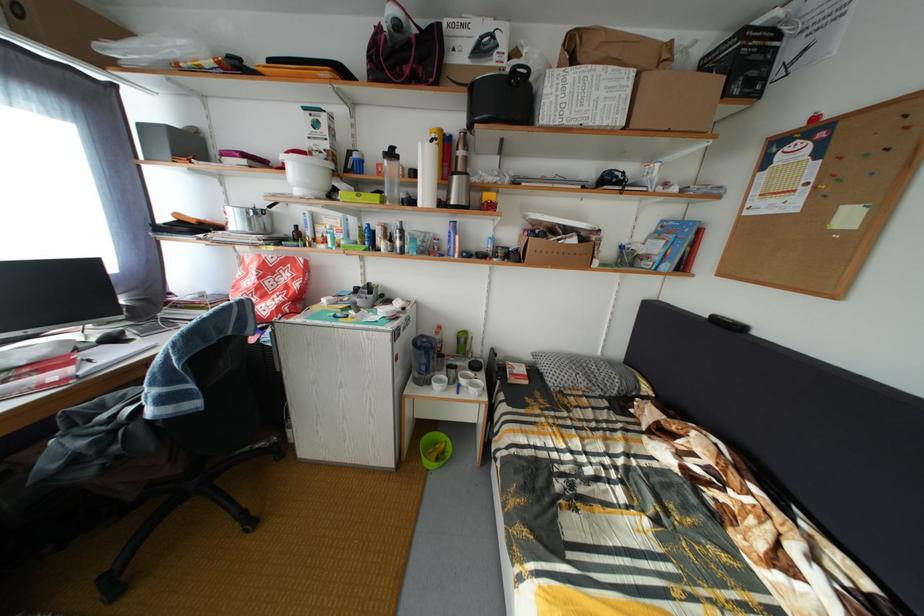
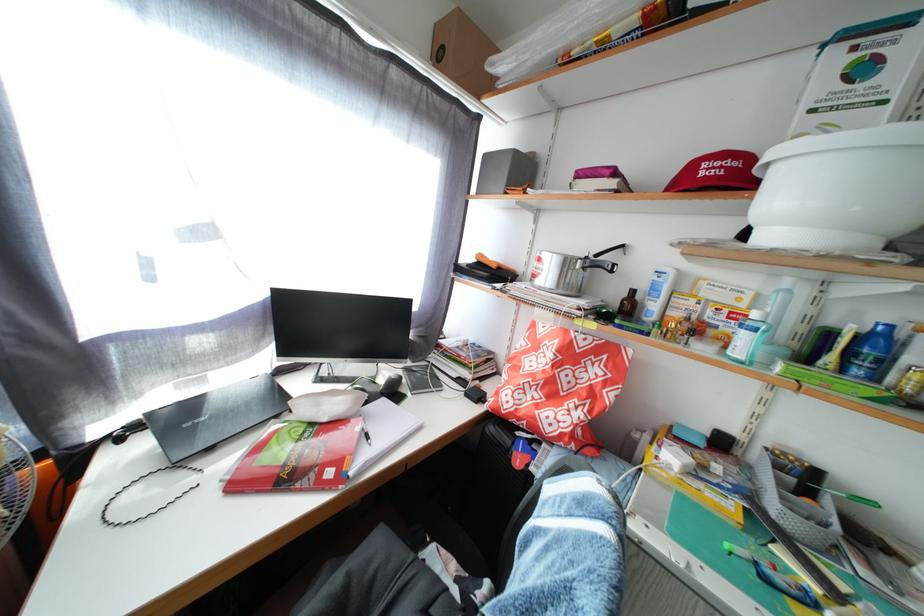
Find the pixel in the second image that matches point (281, 267) in the first image.

(590, 350)